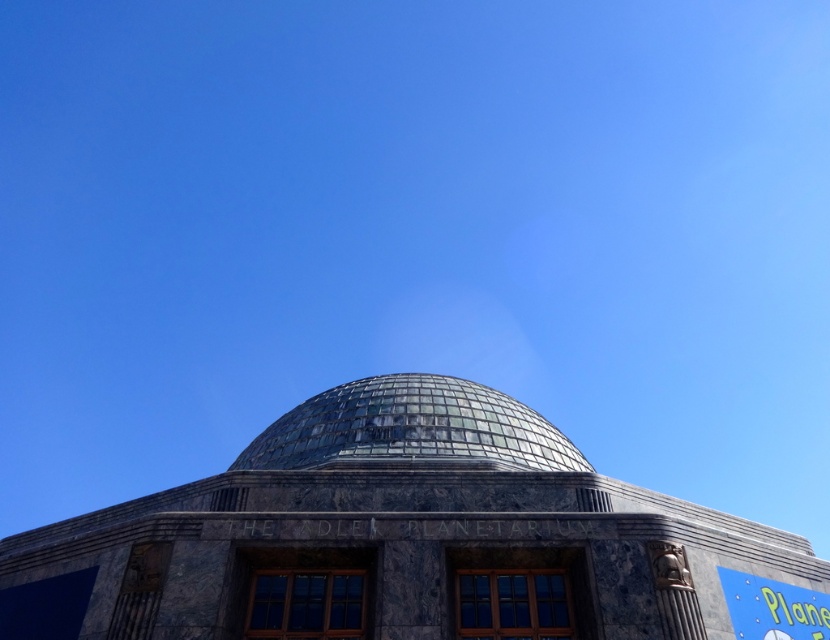
Can you confirm if transparent glass dome at center is positioned to the right of blue painted sign at lower right?

No, transparent glass dome at center is not to the right of blue painted sign at lower right.

Measure the distance between point (x=520, y=456) and camera.

Point (x=520, y=456) is 62.46 meters from camera.

Does point (330, 436) come in front of point (789, 598)?

No, (330, 436) is further to viewer.

What are the coordinates of `transparent glass dome at center` in the screenshot? It's located at (411, 428).